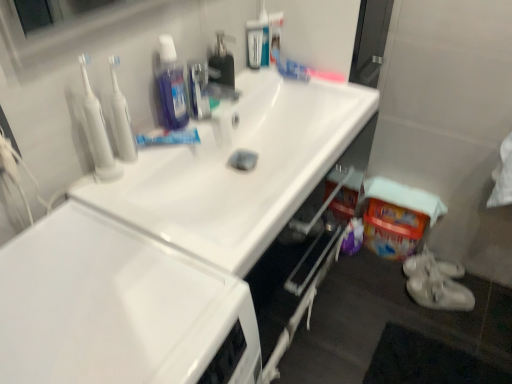
Identify the location of unoccupied region to the right of white plastic toothbrushes at upper left, which ranks as the 1th cleanser in left-to-right order. (148, 165).